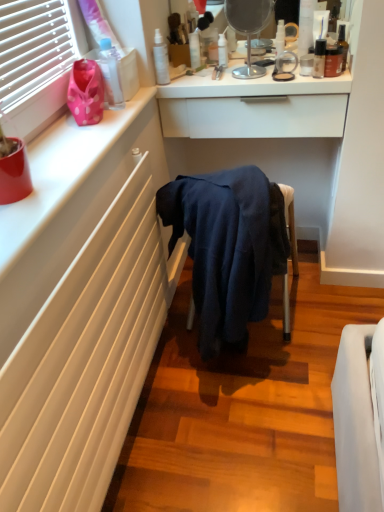
What are the coordinates of `vacant space to the right of dark blue fabric at center` in the screenshot? It's located at (326, 295).